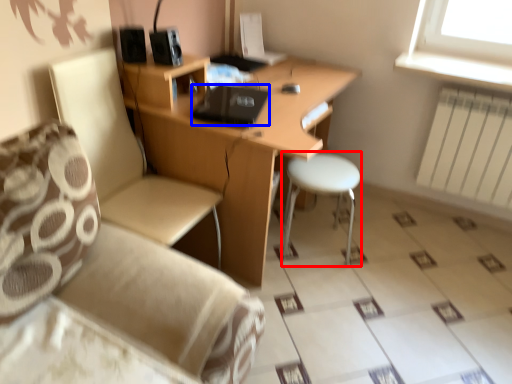
Question: Which object is closer to the camera taking this photo, bar stool (highlighted by a red box) or laptop (highlighted by a blue box)?

Choices:
 (A) bar stool
 (B) laptop

Answer: (B)